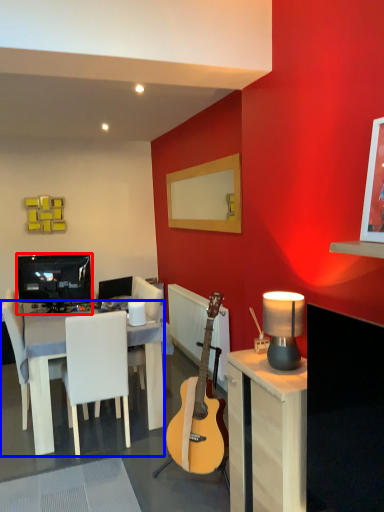
Question: Which object is further to the camera taking this photo, television (highlighted by a red box) or table (highlighted by a blue box)?

Choices:
 (A) television
 (B) table

Answer: (A)